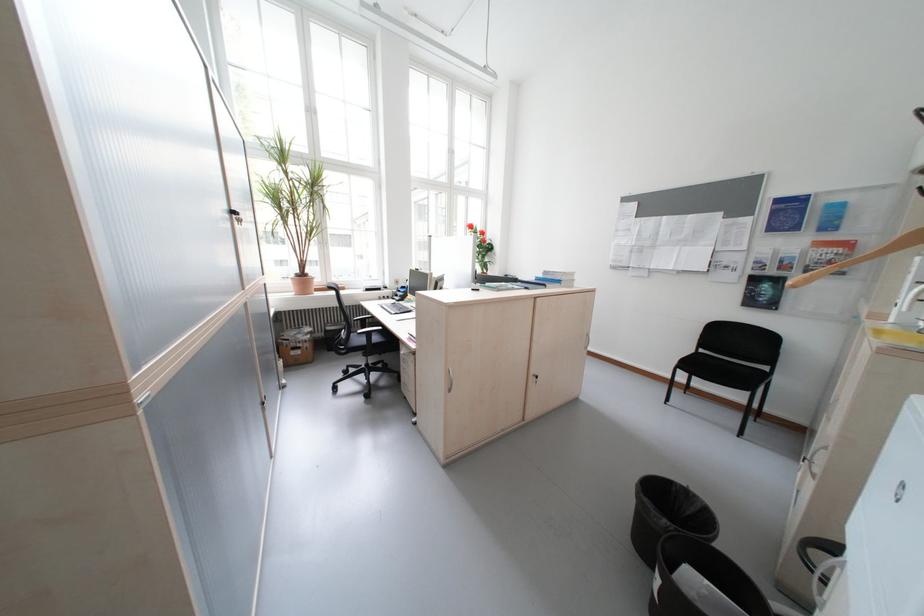
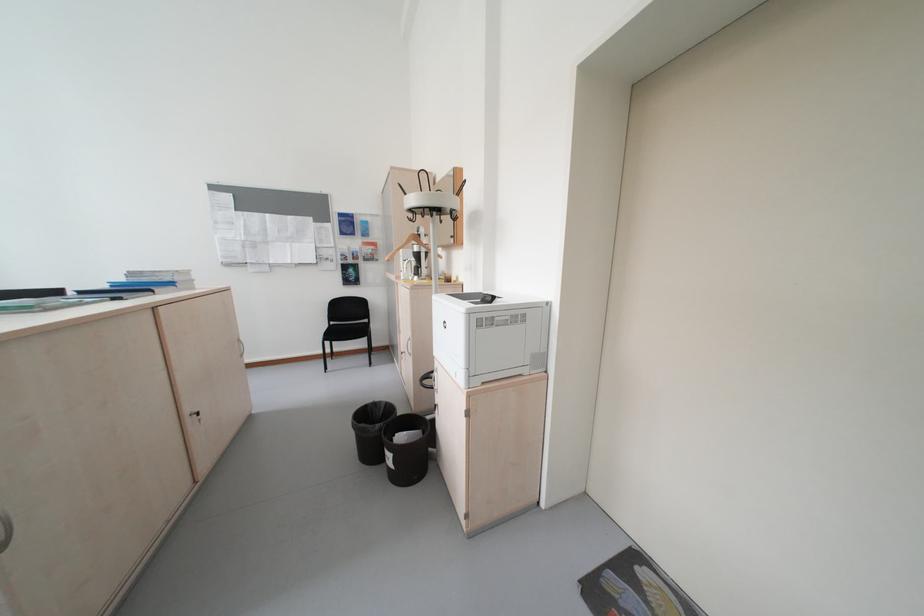
Where in the second image is the point corresponding to [542,379] from the first image?

(200, 421)